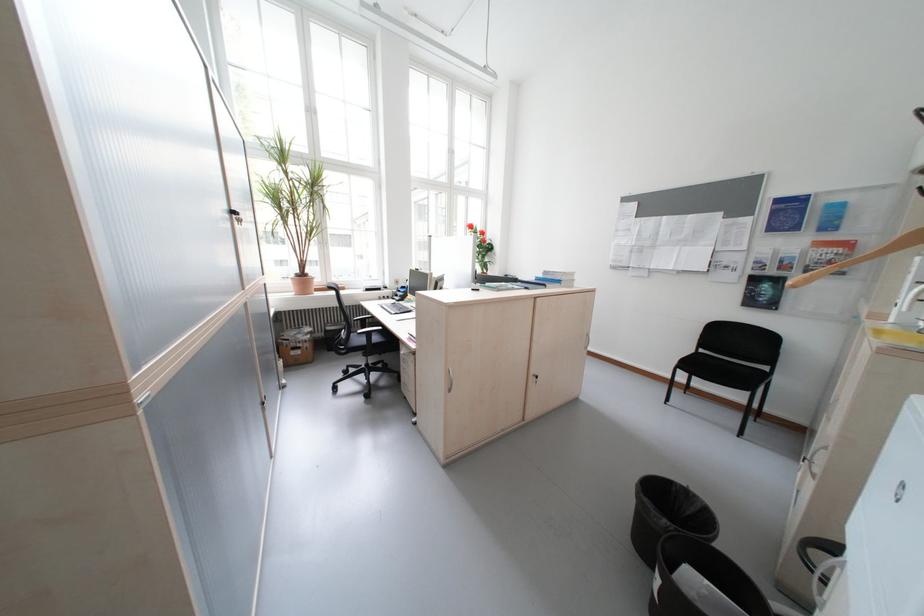
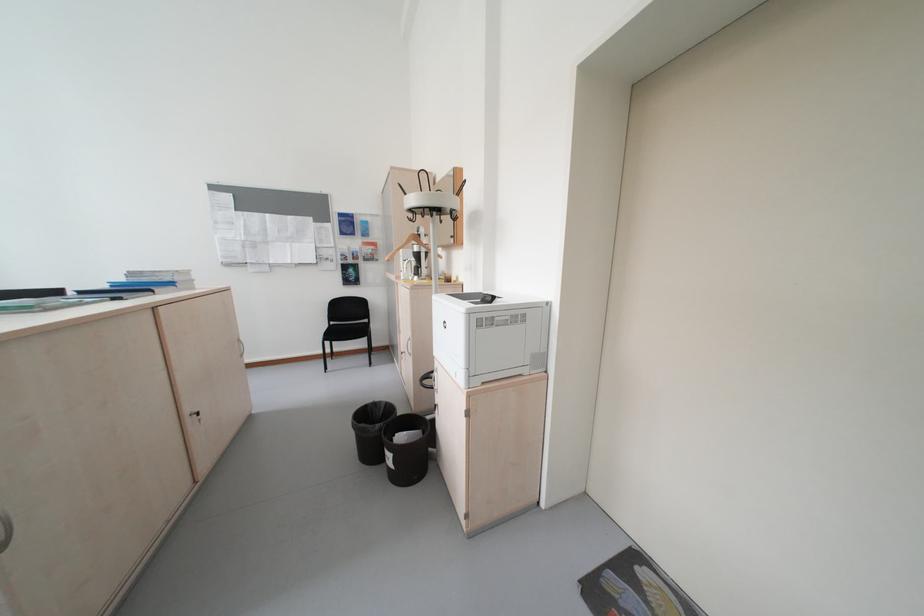
Where in the second image is the point corresponding to [542,379] from the first image?

(200, 421)